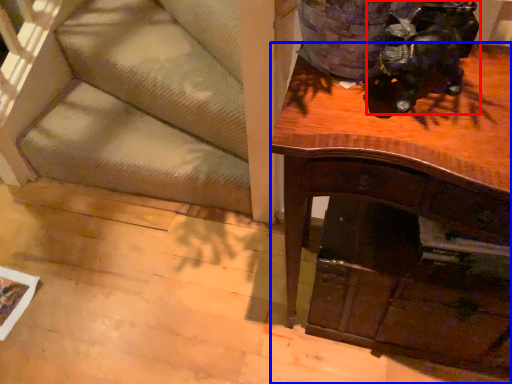
Question: Which point is further to the camera, animal (highlighted by a red box) or desk (highlighted by a blue box)?

Choices:
 (A) animal
 (B) desk

Answer: (A)